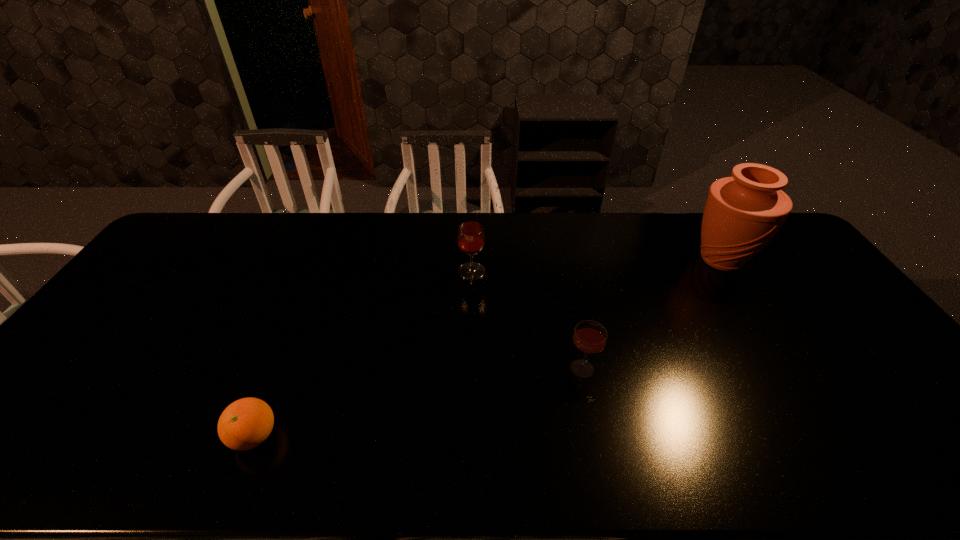
This screenshot has height=540, width=960. I want to click on free space located on the right of the second object from right to left, so click(632, 368).

Image resolution: width=960 pixels, height=540 pixels. In order to click on vacant space located 0.110m on the back of the leftmost object in this screenshot , I will do `click(278, 376)`.

Where is `object positioned at the far edge`? object positioned at the far edge is located at coordinates (743, 213).

At what (x,y) coordinates should I click in order to perform the action: click on object that is at the near edge. Please return your answer as a coordinate pair (x, y). The width and height of the screenshot is (960, 540). Looking at the image, I should click on (246, 423).

I want to click on vacant position at the far edge of the desktop, so click(468, 212).

Find the location of a particular element. The height and width of the screenshot is (540, 960). vacant space at the left edge of the desktop is located at coordinates (117, 354).

The height and width of the screenshot is (540, 960). In the image, there is a desktop. Identify the location of blank space at the right edge. (808, 272).

This screenshot has width=960, height=540. In the image, there is a desktop. Find the location of `free region at the far left corner`. free region at the far left corner is located at coordinates (198, 217).

Identify the location of free space between the taller wineglass and the nearer wineglass. (527, 320).

At what (x,y) coordinates should I click in order to perform the action: click on vacant point located between the orange and the rightmost object. Please return your answer as a coordinate pair (x, y). This screenshot has height=540, width=960. Looking at the image, I should click on coord(488,348).